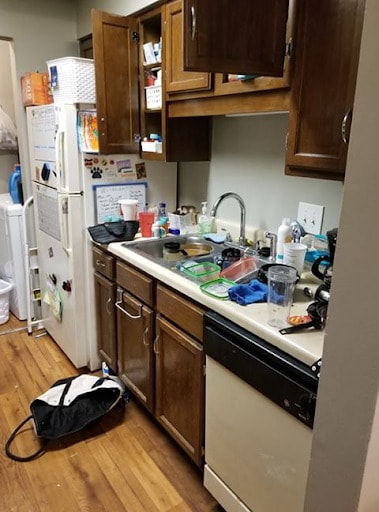
Find the location of `faucet`. faucet is located at coordinates (216, 208).